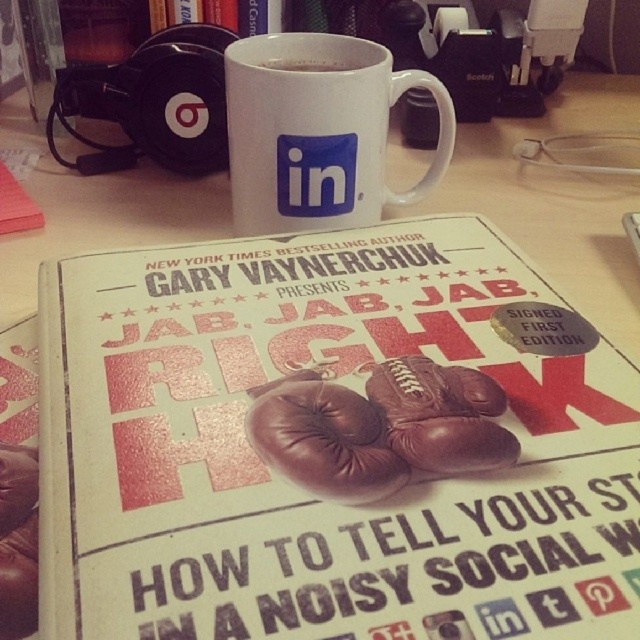
Question: Which object is the closest to the white ceramic mug at center?

Choices:
 (A) white matte poster at center
 (B) brown leather boxing glove at center

Answer: (A)

Question: From the image, what is the correct spatial relationship of white ceramic mug at center in relation to brown leather boxing glove at center?

Choices:
 (A) above
 (B) below

Answer: (A)

Question: In this image, where is white ceramic mug at center located relative to brown leather boxing glove at center?

Choices:
 (A) left
 (B) right

Answer: (A)

Question: Estimate the real-world distances between objects in this image. Which object is farther from the white matte cup at center?

Choices:
 (A) brown leather boxing glove at center
 (B) leather boxing glove at center
 (C) white ceramic mug at center
 (D) white matte poster at center

Answer: (B)

Question: Which point is farther from the camera taking this photo?

Choices:
 (A) (x=472, y=275)
 (B) (x=396, y=445)
 (C) (x=298, y=52)

Answer: (C)

Question: Is brown leather boxing glove at center bigger than white matte cup at center?

Choices:
 (A) yes
 (B) no

Answer: (A)